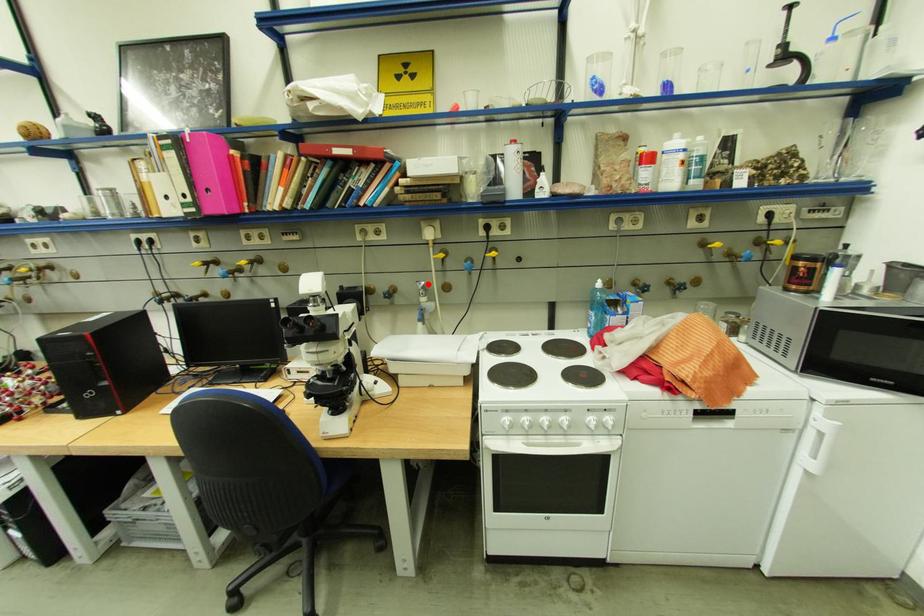
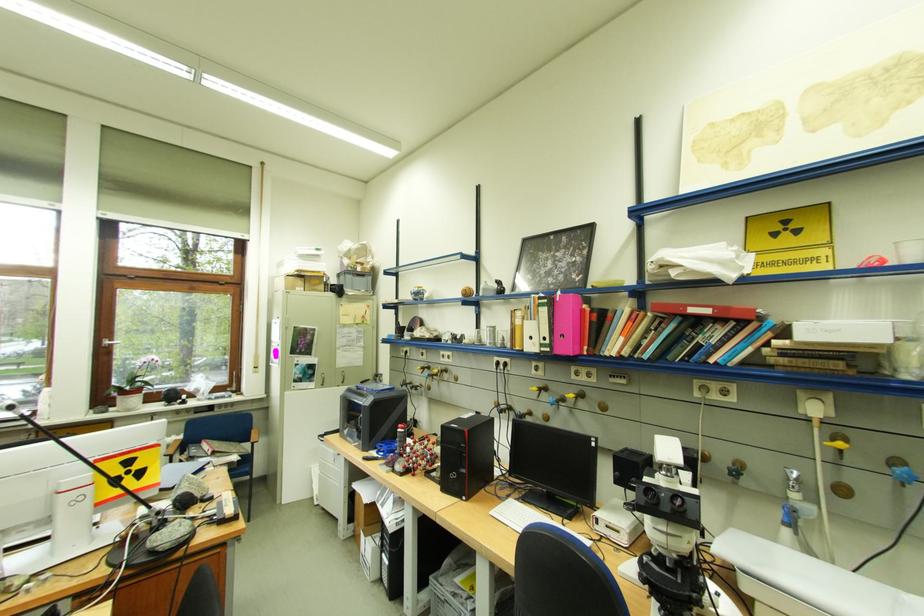
In the second image, find the point that corresponds to the highlighted location in the first image.

(798, 471)